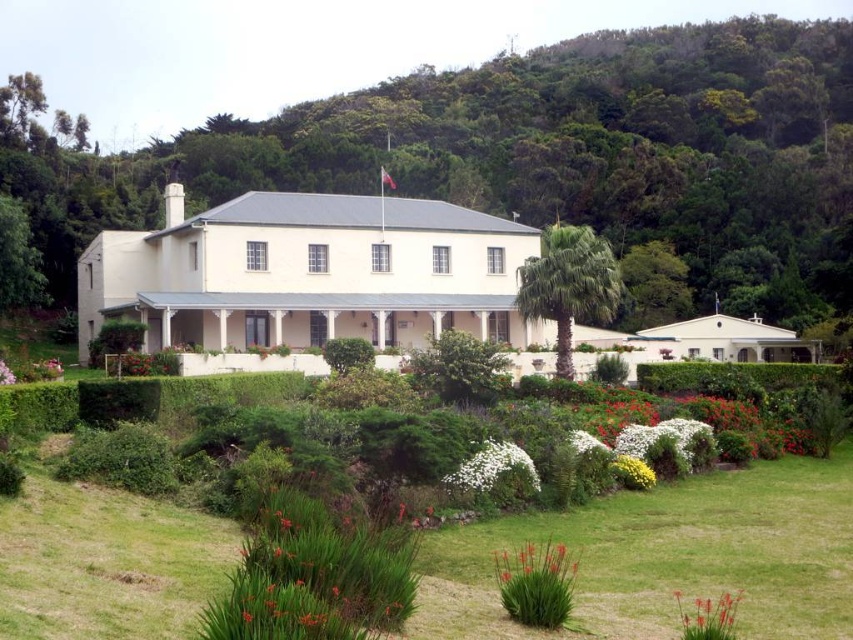
Question: Which of the following is the closest to the observer?

Choices:
 (A) (728, 604)
 (B) (51, 365)
 (C) (625, 465)
 (D) (581, 436)

Answer: (A)

Question: Can you confirm if white fluffy flowers at lower center is smaller than white matte flower at lower left?

Choices:
 (A) no
 (B) yes

Answer: (B)

Question: Which object is positioned closest to the orange grass at lower center?

Choices:
 (A) white fluffy flowers at lower center
 (B) green leafy hill at upper center

Answer: (A)

Question: Is green leafy hill at upper center wider than white fluffy flowers at lower center?

Choices:
 (A) no
 (B) yes

Answer: (B)

Question: Is pink matte flower at lower left to the right of white matte flower at lower left from the viewer's perspective?

Choices:
 (A) no
 (B) yes

Answer: (B)

Question: Which point is farther from the camera taking this photo?

Choices:
 (A) (55, 365)
 (B) (730, 593)

Answer: (A)